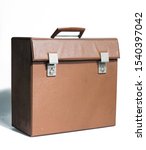
Locate an element on the screen. The height and width of the screenshot is (150, 146). handle is located at coordinates (x=70, y=29).